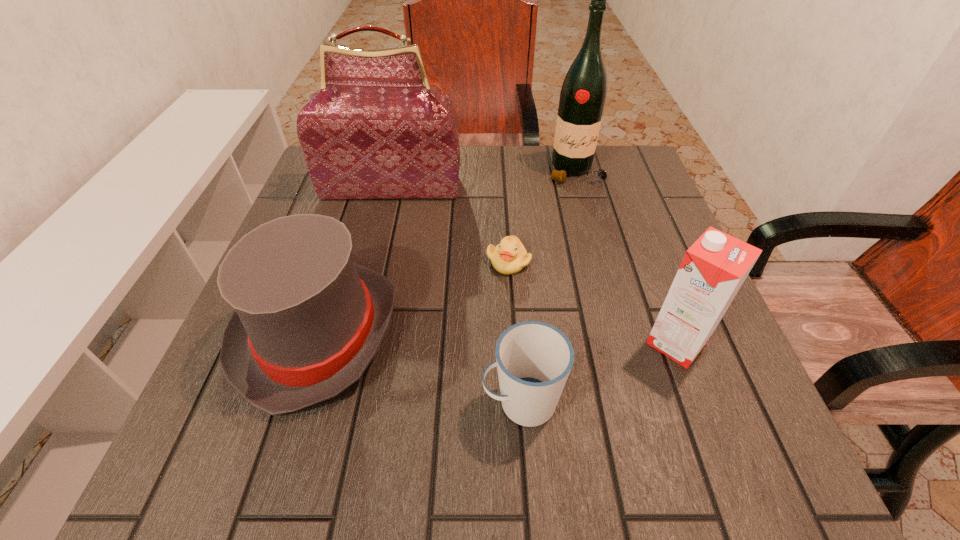
Identify the location of free space that is in between the carton and the fourth tallest object. (497, 338).

Identify the location of empty space that is in between the handbag and the fourth shortest object. (534, 265).

At what (x,y) coordinates should I click in order to perform the action: click on empty location between the handbag and the duckling. Please return your answer as a coordinate pair (x, y). This screenshot has height=540, width=960. Looking at the image, I should click on (450, 225).

Locate an element on the screen. Image resolution: width=960 pixels, height=540 pixels. free spot between the cup and the carton is located at coordinates (599, 373).

The width and height of the screenshot is (960, 540). Identify the location of vacant area that lies between the fourth tallest object and the carton. (497, 338).

You are a GUI agent. You are given a task and a screenshot of the screen. Output one action in this format:
    pyautogui.click(x=<x>, y=<y>)
    Task: Click on the vacant space that's between the duckling and the dress hat
    Image resolution: width=960 pixels, height=540 pixels.
    Given the screenshot: What is the action you would take?
    pyautogui.click(x=414, y=298)

The width and height of the screenshot is (960, 540). In order to click on empty location between the dress hat and the wine bottle in this screenshot , I will do `click(447, 253)`.

The image size is (960, 540). I want to click on free space between the handbag and the shortest object, so click(x=450, y=225).

In order to click on object identified as the fifth closest to the wine bottle in this screenshot , I will do `click(534, 359)`.

At what (x,y) coordinates should I click in order to perform the action: click on object that is the closest to the third shortest object. Please return your answer as a coordinate pair (x, y). The height and width of the screenshot is (540, 960). Looking at the image, I should click on (534, 359).